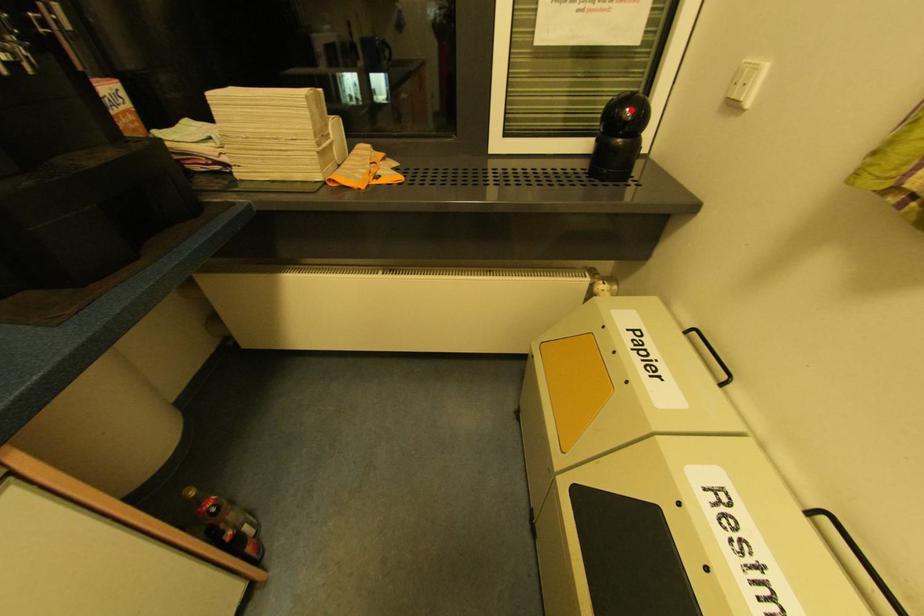
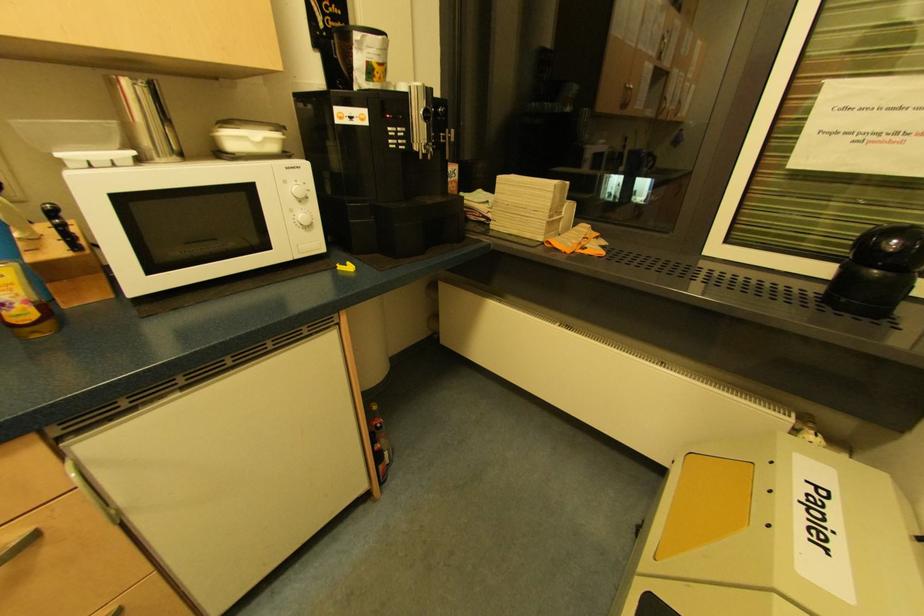
Question: I am providing you with two images of the same scene from different viewpoints. Image1 has a red point marked. In image2, the corresponding 3D location appears at what relative position? Reply with the corresponding letter.

Choices:
 (A) Closer
 (B) Farther

Answer: (B)